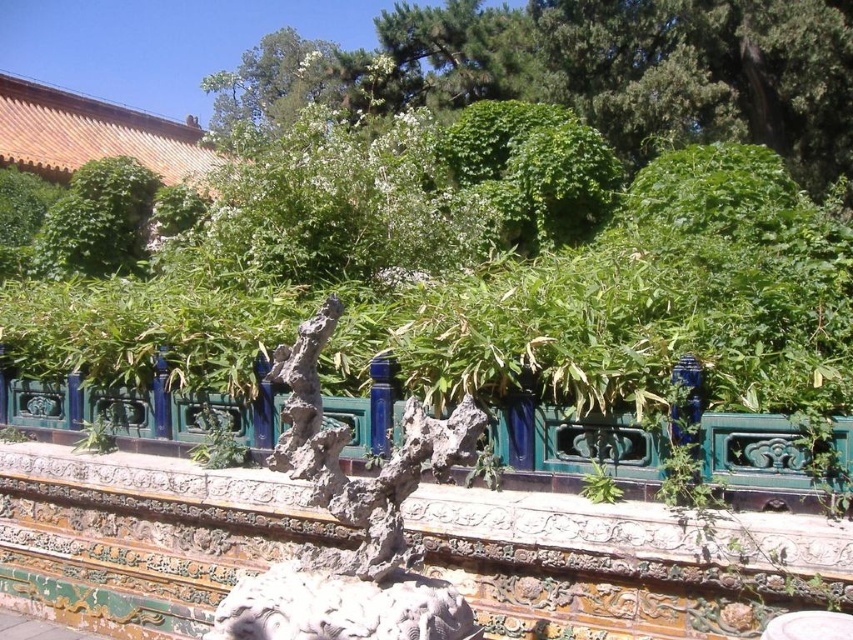
You are a gardener planning to water the green leafy bush at upper left and the green leafy tree at upper center in the traditional Chinese garden. If your watering can has a range of 5 meters, can you water both plants without moving the can?

The green leafy bush at upper left is 5.21 meters away from the green leafy tree at upper center. Since the distance exceeds the watering can range of 5 meters, you cannot water both plants without moving the can.